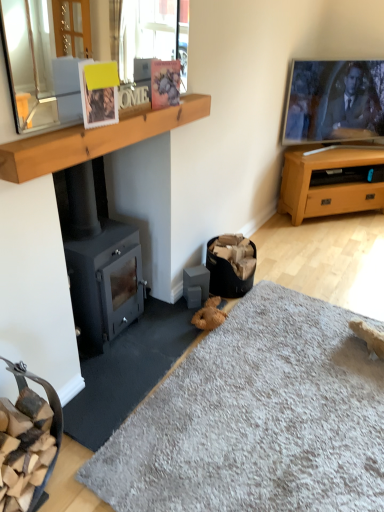
Question: Looking at their shapes, would you say soft gray carpet at lower center is wider or thinner than white matte picture frame at upper center, which appears as the 1th picture frame when viewed from the front?

Choices:
 (A) wide
 (B) thin

Answer: (A)

Question: Is point (238, 401) closer or farther from the camera than point (99, 84)?

Choices:
 (A) farther
 (B) closer

Answer: (A)

Question: Which of these objects is positioned farthest from the soft gray carpet at lower center?

Choices:
 (A) light brown wood tv stand at right
 (B) wooden at upper center
 (C) matte plastic picture frame at upper center, acting as the first picture frame starting from the back
 (D) flat-screen tv at upper right
 (E) matte black wood burning stove at left

Answer: (D)

Question: Which is nearer to the white matte picture frame at upper center, which is the second picture frame in back-to-front order?

Choices:
 (A) light brown wood tv stand at right
 (B) soft gray carpet at lower center
 (C) matte plastic picture frame at upper center, the 2th picture frame when ordered from front to back
 (D) wooden at upper center
 (E) matte black wood burning stove at left

Answer: (D)